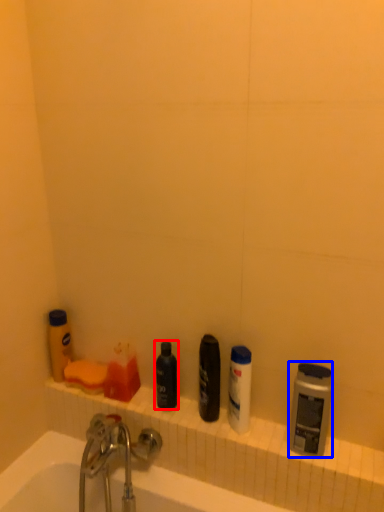
Question: Among these objects, which one is nearest to the camera, toiletry (highlighted by a red box) or toiletry (highlighted by a blue box)?

Choices:
 (A) toiletry
 (B) toiletry

Answer: (B)